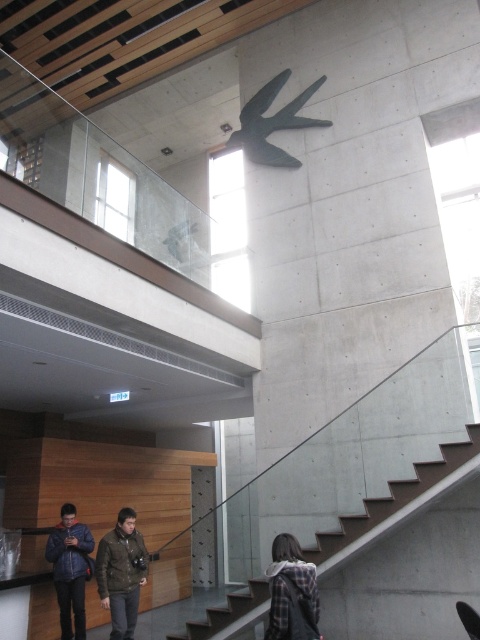
Who is shorter, dark green jacket at lower center or denim jacket at lower left?

With less height is dark green jacket at lower center.

Based on the photo, can you confirm if dark green jacket at lower center is smaller than denim jacket at lower left?

Yes, dark green jacket at lower center is smaller than denim jacket at lower left.

Where is `dark green jacket at lower center`? The image size is (480, 640). dark green jacket at lower center is located at coordinates (121, 573).

Where is `concrete stairs at center`? concrete stairs at center is located at coordinates (396, 497).

Who is positioned more to the left, concrete stairs at center or plaid fabric at lower right?

plaid fabric at lower right is more to the left.

Where is `concrete stairs at center`? This screenshot has width=480, height=640. concrete stairs at center is located at coordinates [396, 497].

At what (x,y) coordinates should I click in order to perform the action: click on concrete stairs at center. Please return your answer as a coordinate pair (x, y). This screenshot has height=640, width=480. Looking at the image, I should click on click(396, 497).

Is denim jacket at lower left taller than plaid fabric at lower right?

Indeed, denim jacket at lower left has a greater height compared to plaid fabric at lower right.

Between denim jacket at lower left and plaid fabric at lower right, which one appears on the left side from the viewer's perspective?

From the viewer's perspective, denim jacket at lower left appears more on the left side.

Which is in front, point (67, 513) or point (311, 588)?

Point (311, 588)

Locate an element on the screen. The height and width of the screenshot is (640, 480). denim jacket at lower left is located at coordinates (70, 570).